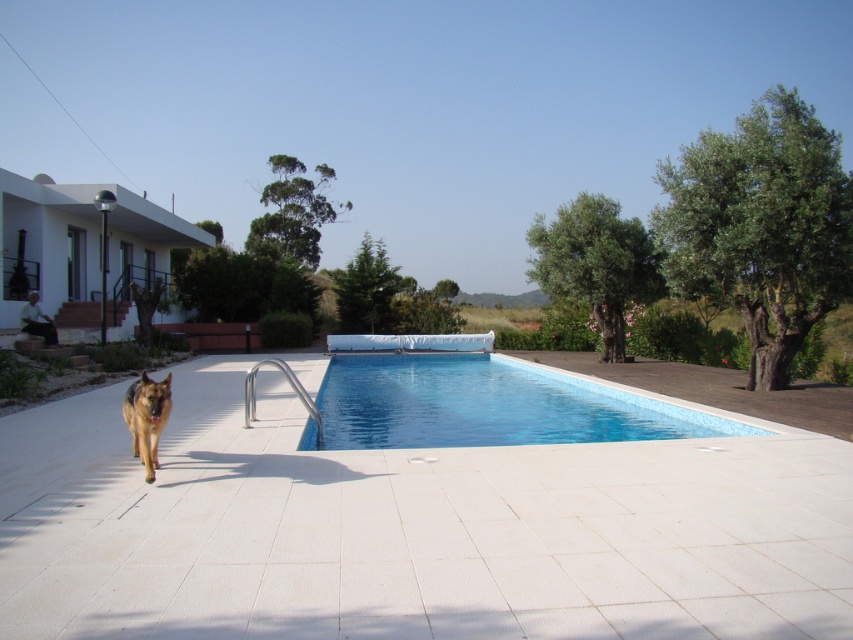
You are standing at the point marked as point (485, 406) in the image. Based on the scene description, what surface are you currently standing on?

The point (485, 406) is on the blue smooth pool at center, so you are standing on the blue smooth pool at center.

You are a photographer planning to capture the blue smooth pool at center and the golden brown fur dog at center in a single shot. Based on their sizes in the image, which object would appear larger in the final photograph?

The blue smooth pool at center appears much larger than the golden brown fur dog at center in the image, so it would be the larger object in the photograph.

You are a dog owner who wants to ensure your golden brown fur dog at center stays cool on a hot day. Given that the blue smooth pool at center is nearby, can you determine if the dog can easily access the pool from its current position?

The blue smooth pool at center is located below golden brown fur dog at center, so the dog can easily access the pool by moving downward to the blue smooth pool at center.